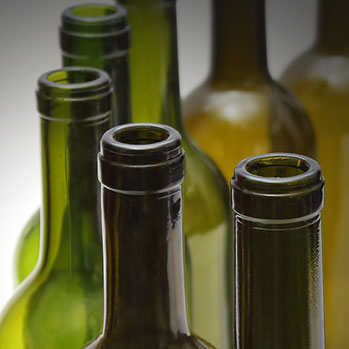
Where is `bottle`? Image resolution: width=349 pixels, height=349 pixels. bottle is located at coordinates (161, 309).